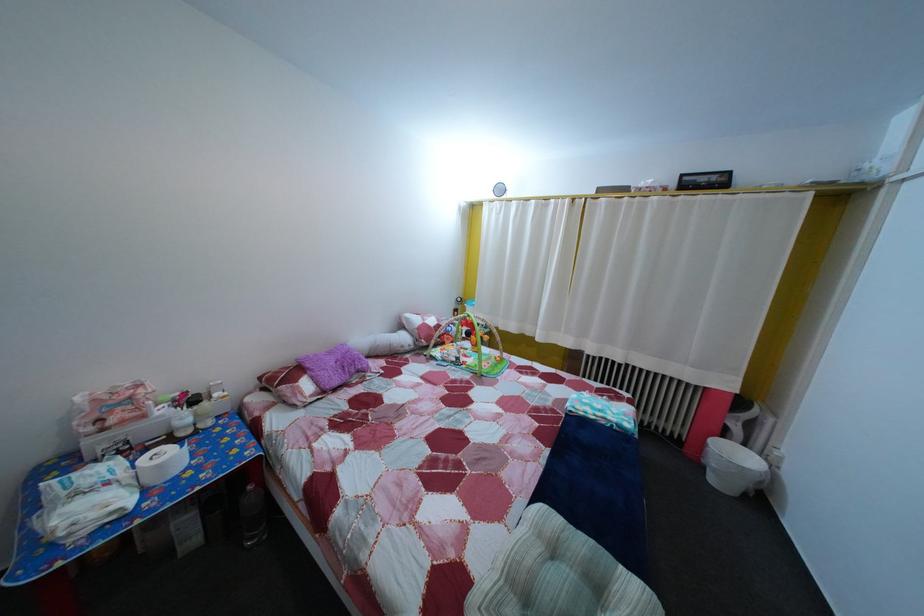
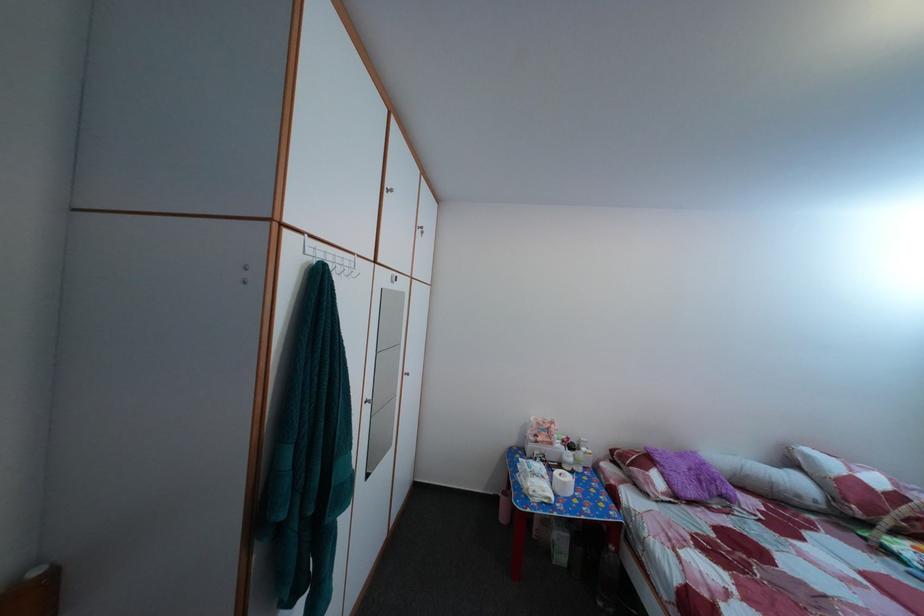
Find the pixel in the second image that matches pixel 417 326 in the first image.

(817, 464)